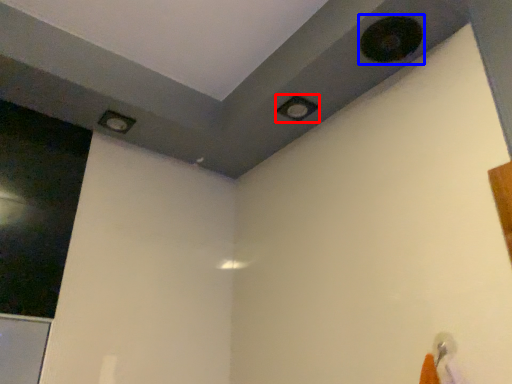
Question: Which of the following is the farthest to the observer, hole (highlighted by a red box) or hole (highlighted by a blue box)?

Choices:
 (A) hole
 (B) hole

Answer: (A)